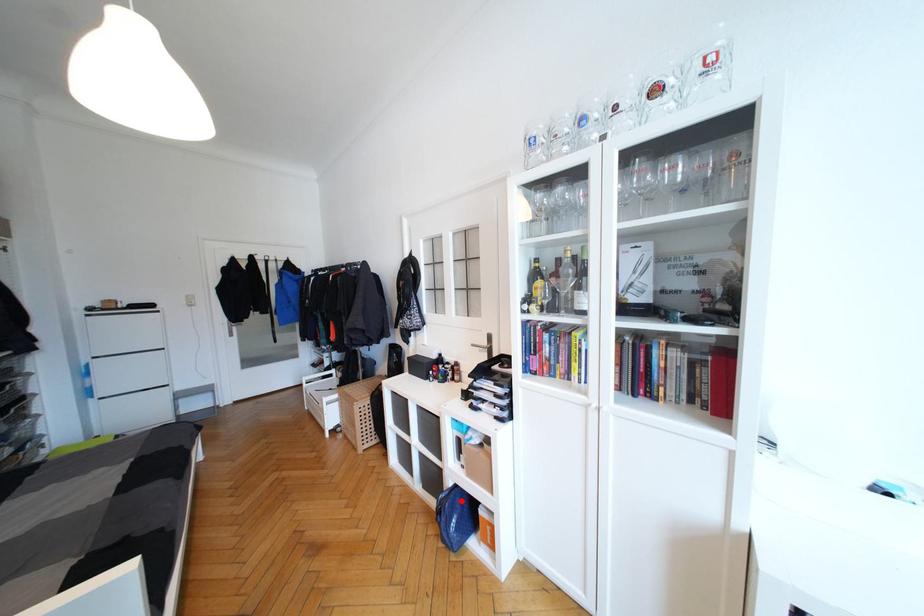
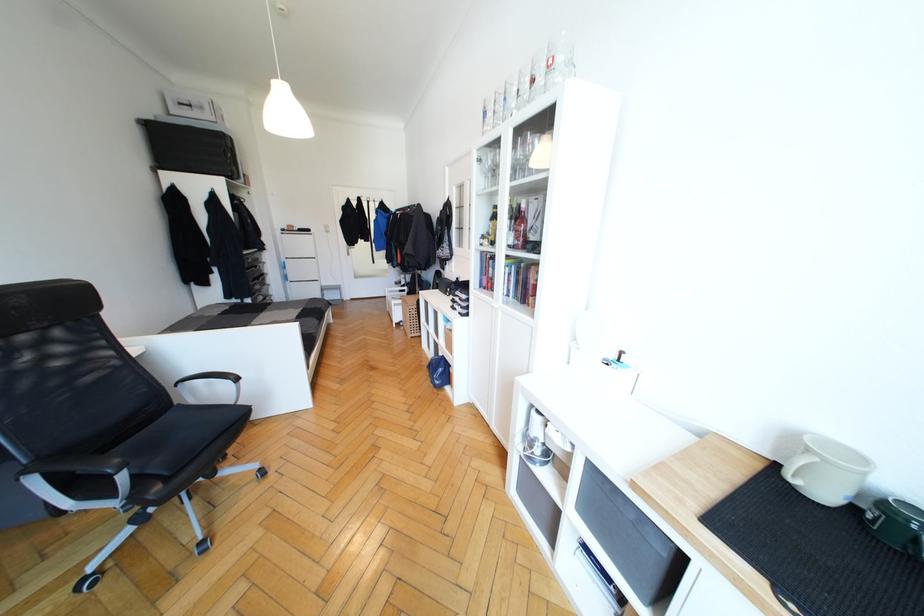
Question: I am providing you with two images of the same scene from different viewpoints. A red point is marked on the first image. At the location where the point appears in image 1, is it still visible in image 2?

Choices:
 (A) Yes
 (B) No

Answer: (A)